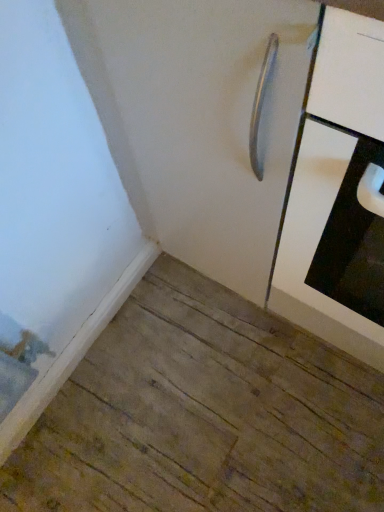
What do you see at coordinates (331, 178) in the screenshot?
I see `white glossy cabinet at upper right` at bounding box center [331, 178].

This screenshot has width=384, height=512. Find the location of `white glossy cabinet at upper right`. white glossy cabinet at upper right is located at coordinates (331, 178).

I want to click on white matte door at center, so click(x=198, y=120).

The height and width of the screenshot is (512, 384). Describe the element at coordinates (198, 120) in the screenshot. I see `white matte door at center` at that location.

This screenshot has width=384, height=512. I want to click on white glossy cabinet at upper right, so click(331, 178).

Does white matte door at center appear on the right side of white glossy cabinet at upper right?

No, white matte door at center is not to the right of white glossy cabinet at upper right.

Considering their positions, is white matte door at center located in front of or behind white glossy cabinet at upper right?

In the image, white matte door at center appears behind white glossy cabinet at upper right.

Is point (242, 179) closer or farther from the camera than point (368, 69)?

Clearly, point (242, 179) is more distant from the camera than point (368, 69).

From the image's perspective, relative to white glossy cabinet at upper right, is white matte door at center above or below?

white matte door at center is above white glossy cabinet at upper right.

From a real-world perspective, is white matte door at center positioned under white glossy cabinet at upper right based on gravity?

Yes, from a real-world perspective, white matte door at center is below white glossy cabinet at upper right.

Between white matte door at center and white glossy cabinet at upper right, which one has smaller width?

With smaller width is white matte door at center.

Considering the sizes of objects white matte door at center and white glossy cabinet at upper right in the image provided, who is taller, white matte door at center or white glossy cabinet at upper right?

white glossy cabinet at upper right.

Who is smaller, white matte door at center or white glossy cabinet at upper right?

white glossy cabinet at upper right is smaller.

Can white glossy cabinet at upper right be found inside white matte door at center?

No, white glossy cabinet at upper right is not a part of white matte door at center.

Are white matte door at center and white glossy cabinet at upper right beside each other?

white matte door at center and white glossy cabinet at upper right are not in contact.

Is white glossy cabinet at upper right at the back of white matte door at center?

white matte door at center does not have its back to white glossy cabinet at upper right.

What's the angular difference between white matte door at center and white glossy cabinet at upper right's facing directions?

0.414 degrees separate the facing orientations of white matte door at center and white glossy cabinet at upper right.

How far apart are white matte door at center and white glossy cabinet at upper right?

white matte door at center is 6.22 inches from white glossy cabinet at upper right.

You are a GUI agent. You are given a task and a screenshot of the screen. Output one action in this format:
    pyautogui.click(x=<x>, y=<y>)
    Task: Click on the cabinetry that is below the white matte door at center (from the image's perspective)
    Image resolution: width=384 pixels, height=512 pixels.
    Given the screenshot: What is the action you would take?
    pyautogui.click(x=331, y=178)

Is white glossy cabinet at upper right to the left or to the right of white matte door at center in the image?

Based on their positions, white glossy cabinet at upper right is located to the right of white matte door at center.

Is white glossy cabinet at upper right in front of white matte door at center?

Yes, white glossy cabinet at upper right is closer to the viewer.

Considering the positions of points (305, 205) and (176, 122), is point (305, 205) closer to camera compared to point (176, 122)?

Yes, it is.

From the image's perspective, is white glossy cabinet at upper right on white matte door at center?

Incorrect, from the image's perspective, white glossy cabinet at upper right is lower than white matte door at center.

From a real-world perspective, is white glossy cabinet at upper right positioned above or below white matte door at center?

Clearly, from a real-world perspective, white glossy cabinet at upper right is above white matte door at center.

Can you confirm if white glossy cabinet at upper right is thinner than white matte door at center?

In fact, white glossy cabinet at upper right might be wider than white matte door at center.

From their relative heights in the image, would you say white glossy cabinet at upper right is taller or shorter than white matte door at center?

white glossy cabinet at upper right is taller than white matte door at center.

Who is smaller, white glossy cabinet at upper right or white matte door at center?

white glossy cabinet at upper right.

Is white glossy cabinet at upper right not inside white matte door at center?

Yes, white glossy cabinet at upper right is located beyond the bounds of white matte door at center.

Is white glossy cabinet at upper right far away from white matte door at center?

white glossy cabinet at upper right is actually quite close to white matte door at center.

Is white matte door at center at the back of white glossy cabinet at upper right?

No, white glossy cabinet at upper right is not facing the opposite direction of white matte door at center.

Based on the photo, measure the distance from white glossy cabinet at upper right to white matte door at center.

white glossy cabinet at upper right is 6.22 inches from white matte door at center.

Locate an element on the screen. door lying above the white glossy cabinet at upper right (from the image's perspective) is located at coordinates (198, 120).

This screenshot has height=512, width=384. Find the location of `cabinetry in front of the white matte door at center`. cabinetry in front of the white matte door at center is located at coordinates (331, 178).

Where is `door beneath the white glossy cabinet at upper right (from a real-world perspective)`? This screenshot has width=384, height=512. door beneath the white glossy cabinet at upper right (from a real-world perspective) is located at coordinates (198, 120).